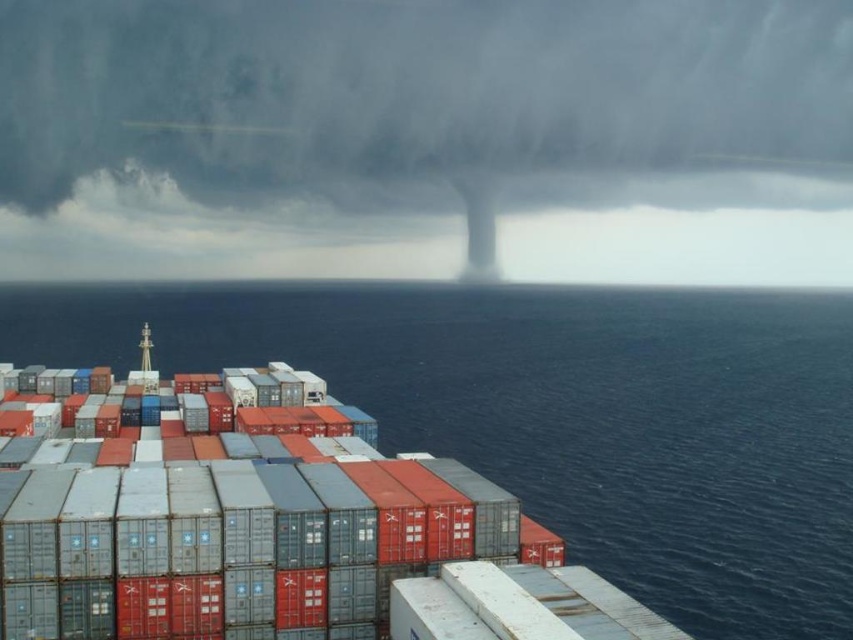
Question: Which of the following is the closest to the observer?

Choices:
 (A) dark gray cloud at upper center
 (B) blue water at lower left

Answer: (B)

Question: Is dark gray cloud at upper center positioned before blue water at lower left?

Choices:
 (A) no
 (B) yes

Answer: (A)

Question: Can you confirm if dark gray cloud at upper center is bigger than blue water at lower left?

Choices:
 (A) yes
 (B) no

Answer: (A)

Question: Which object appears farthest from the camera in this image?

Choices:
 (A) blue water at lower left
 (B) dark gray cloud at upper center

Answer: (B)

Question: Is dark gray cloud at upper center thinner than blue water at lower left?

Choices:
 (A) yes
 (B) no

Answer: (B)